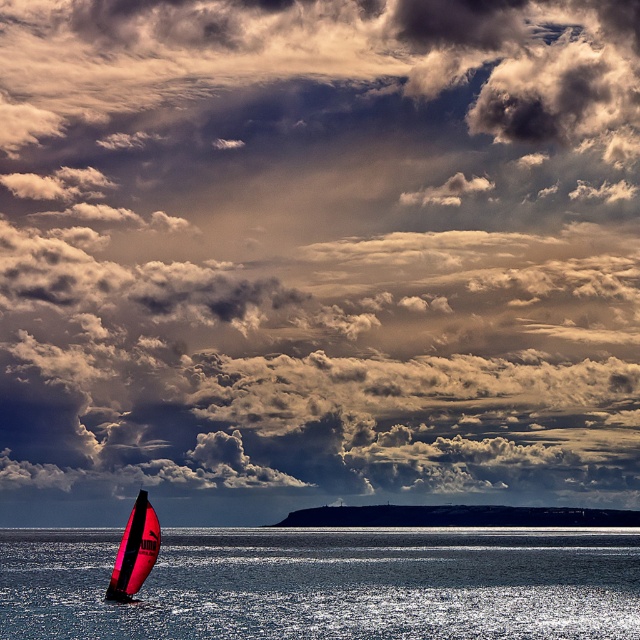
Is point (349, 620) in front of point (134, 518)?

Yes, it is.

Does transparent blue water at lower center have a greater height compared to shiny pink sailboat at lower left?

Yes, transparent blue water at lower center is taller than shiny pink sailboat at lower left.

The image size is (640, 640). What do you see at coordinates (326, 582) in the screenshot?
I see `transparent blue water at lower center` at bounding box center [326, 582].

Locate an element on the screen. transparent blue water at lower center is located at coordinates (326, 582).